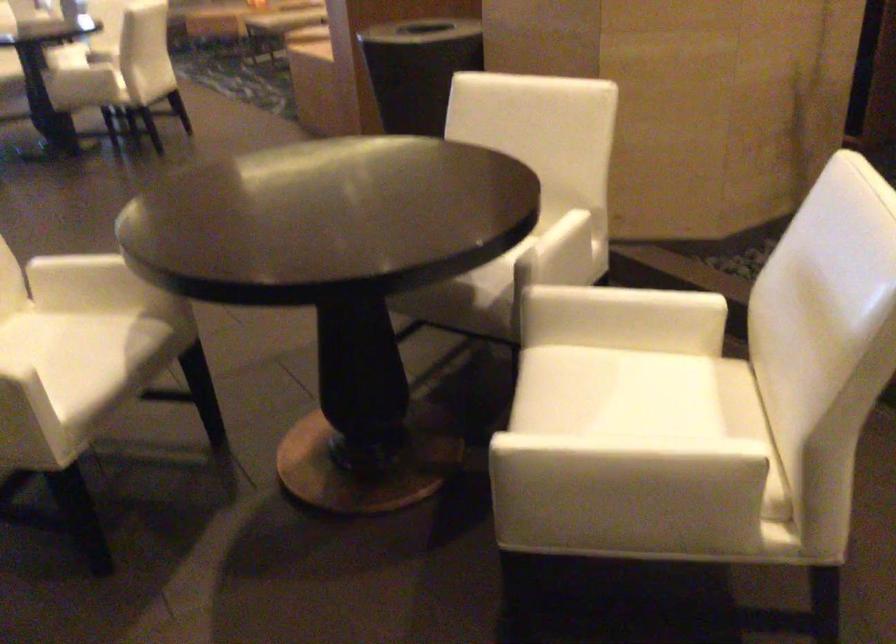
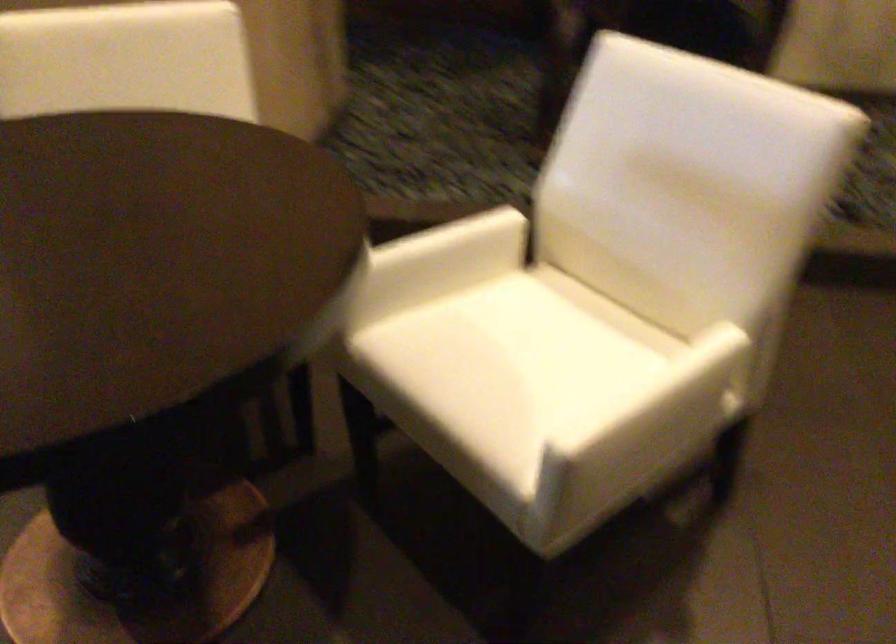
Find the pixel in the second image that matches (651,305) in the first image.

(468, 239)